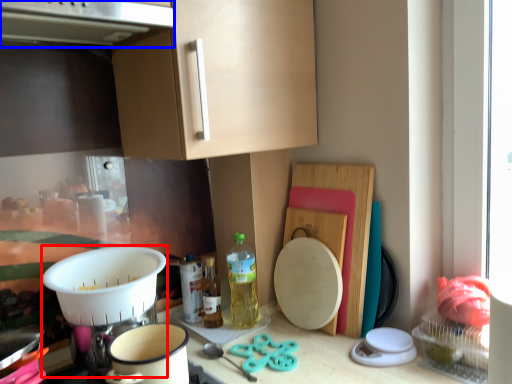
Question: Which point is further to the camera, appliance (highlighted by a red box) or exhaust hood (highlighted by a blue box)?

Choices:
 (A) appliance
 (B) exhaust hood

Answer: (A)